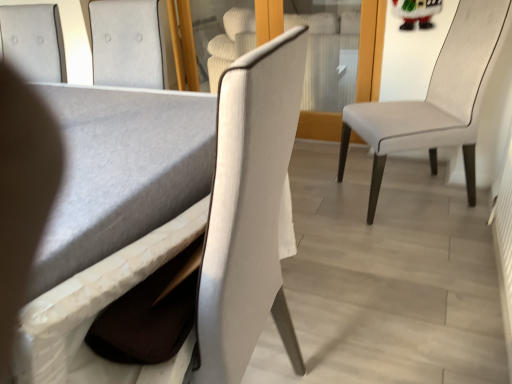
Question: Is white leather chair at right, placed as the 1th chair when sorted from right to left, surrounding matte gray table at lower left?

Choices:
 (A) no
 (B) yes

Answer: (A)

Question: Considering the relative sizes of white leather chair at right, placed as the 1th chair when sorted from right to left, and matte gray table at lower left in the image provided, is white leather chair at right, placed as the 1th chair when sorted from right to left, thinner than matte gray table at lower left?

Choices:
 (A) yes
 (B) no

Answer: (B)

Question: Does white leather chair at right, placed as the 1th chair when sorted from right to left, have a lesser height compared to matte gray table at lower left?

Choices:
 (A) yes
 (B) no

Answer: (A)

Question: Are white leather chair at right, placed as the 1th chair when sorted from right to left, and matte gray table at lower left far apart?

Choices:
 (A) no
 (B) yes

Answer: (B)

Question: From a real-world perspective, is white leather chair at right, which is counted as the 3th chair, starting from the left, below matte gray table at lower left?

Choices:
 (A) yes
 (B) no

Answer: (A)

Question: Is white leather chair at right, placed as the 1th chair when sorted from right to left, in front of matte gray table at lower left?

Choices:
 (A) no
 (B) yes

Answer: (A)

Question: Is transparent glass door at center oriented towards matte gray table at lower left?

Choices:
 (A) no
 (B) yes

Answer: (A)

Question: Is transparent glass door at center positioned with its back to matte gray table at lower left?

Choices:
 (A) yes
 (B) no

Answer: (A)

Question: Does transparent glass door at center have a greater height compared to matte gray table at lower left?

Choices:
 (A) yes
 (B) no

Answer: (B)

Question: From a real-world perspective, is transparent glass door at center physically below matte gray table at lower left?

Choices:
 (A) yes
 (B) no

Answer: (A)

Question: Considering the relative positions of transparent glass door at center and matte gray table at lower left in the image provided, is transparent glass door at center to the right of matte gray table at lower left from the viewer's perspective?

Choices:
 (A) yes
 (B) no

Answer: (A)

Question: Does transparent glass door at center have a smaller size compared to matte gray table at lower left?

Choices:
 (A) no
 (B) yes

Answer: (A)

Question: Is white leather chair at right, which is counted as the 3th chair, starting from the left, not within transparent glass door at center?

Choices:
 (A) no
 (B) yes

Answer: (B)